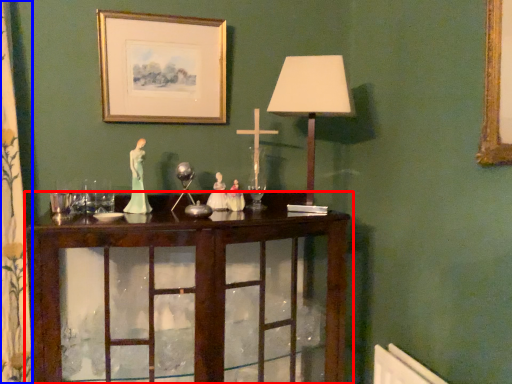
Question: Among these objects, which one is nearest to the camera, table (highlighted by a red box) or curtain (highlighted by a blue box)?

Choices:
 (A) table
 (B) curtain

Answer: (A)